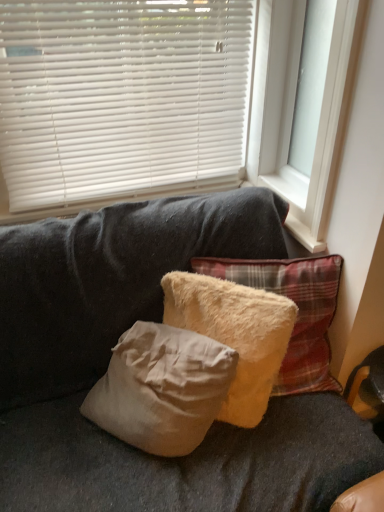
You are a GUI agent. You are given a task and a screenshot of the screen. Output one action in this format:
    pyautogui.click(x=<x>, y=<y>)
    Task: Click on the fuzzy beige pillow at center, which is the 1th pillow from right to left
    
    Given the screenshot: What is the action you would take?
    pyautogui.click(x=298, y=312)

The image size is (384, 512). What do you see at coordinates (121, 96) in the screenshot?
I see `white plastic blinds at upper center` at bounding box center [121, 96].

Locate an element on the screen. The width and height of the screenshot is (384, 512). white plastic blinds at upper center is located at coordinates (121, 96).

The image size is (384, 512). I want to click on fuzzy beige pillow at center, which is the 1th pillow from right to left, so click(x=298, y=312).

Does white plastic blinds at upper center have a smaller size compared to white plastic window frame at upper right?

Actually, white plastic blinds at upper center might be larger than white plastic window frame at upper right.

From a real-world perspective, which is physically below, white plastic blinds at upper center or white plastic window frame at upper right?

white plastic window frame at upper right, from a real-world perspective.

This screenshot has width=384, height=512. What are the coordinates of `window frame in front of the white plastic blinds at upper center` in the screenshot? It's located at (304, 105).

Would you consider white plastic blinds at upper center to be distant from white plastic window frame at upper right?

They are positioned close to each other.

Consider the image. Looking at the image, does white plastic window frame at upper right seem bigger or smaller compared to white plastic blinds at upper center?

Clearly, white plastic window frame at upper right is smaller in size than white plastic blinds at upper center.

Is point (311, 154) in front of point (125, 124)?

No, (311, 154) is behind (125, 124).

Is white plastic window frame at upper right far from white plastic blinds at upper center?

No, white plastic window frame at upper right is in close proximity to white plastic blinds at upper center.

Is white plastic window frame at upper right to the right of white plastic blinds at upper center from the viewer's perspective?

Yes, white plastic window frame at upper right is to the right of white plastic blinds at upper center.

Could you measure the distance between fuzzy beige pillow at center, the second pillow in the left-to-right sequence, and beige fluffy pillow at center, positioned as the second pillow in right-to-left order?

fuzzy beige pillow at center, the second pillow in the left-to-right sequence, is 5.28 inches from beige fluffy pillow at center, positioned as the second pillow in right-to-left order.

Is fuzzy beige pillow at center, the second pillow in the left-to-right sequence, surrounding beige fluffy pillow at center, which ranks as the first pillow in left-to-right order?

Yes, fuzzy beige pillow at center, the second pillow in the left-to-right sequence, contains beige fluffy pillow at center, which ranks as the first pillow in left-to-right order.

Which of these two, fuzzy beige pillow at center, which is the 1th pillow from right to left, or beige fluffy pillow at center, which ranks as the first pillow in left-to-right order, is wider?

With larger width is fuzzy beige pillow at center, which is the 1th pillow from right to left.

Is white plastic window frame at upper right beside beige fluffy pillow at center, positioned as the second pillow in right-to-left order?

Result: No, white plastic window frame at upper right is not making contact with beige fluffy pillow at center, positioned as the second pillow in right-to-left order.

From the image's perspective, between white plastic window frame at upper right and beige fluffy pillow at center, which ranks as the first pillow in left-to-right order, which one is located above?

white plastic window frame at upper right is shown above in the image.

Is white plastic window frame at upper right oriented away from beige fluffy pillow at center, positioned as the second pillow in right-to-left order?

That's not correct — white plastic window frame at upper right is not looking away from beige fluffy pillow at center, positioned as the second pillow in right-to-left order.

Which object is positioned more to the left, white plastic window frame at upper right or beige fluffy pillow at center, positioned as the second pillow in right-to-left order?

beige fluffy pillow at center, positioned as the second pillow in right-to-left order, is more to the left.

Is fuzzy beige pillow at center, the second pillow in the left-to-right sequence, located within white plastic blinds at upper center?

No, fuzzy beige pillow at center, the second pillow in the left-to-right sequence, is located outside of white plastic blinds at upper center.

From a real-world perspective, does white plastic blinds at upper center stand above fuzzy beige pillow at center, which is the 1th pillow from right to left?

Correct, in the physical world, white plastic blinds at upper center is higher than fuzzy beige pillow at center, which is the 1th pillow from right to left.

How distant is white plastic blinds at upper center from fuzzy beige pillow at center, which is the 1th pillow from right to left?

white plastic blinds at upper center is 26.44 inches from fuzzy beige pillow at center, which is the 1th pillow from right to left.

Is white plastic blinds at upper center oriented towards fuzzy beige pillow at center, the second pillow in the left-to-right sequence?

No, white plastic blinds at upper center does not turn towards fuzzy beige pillow at center, the second pillow in the left-to-right sequence.

From a real-world perspective, is white plastic blinds at upper center beneath beige fluffy pillow at center, which ranks as the first pillow in left-to-right order?

No.

Is beige fluffy pillow at center, positioned as the second pillow in right-to-left order, at the back of white plastic blinds at upper center?

That's not correct — white plastic blinds at upper center is not looking away from beige fluffy pillow at center, positioned as the second pillow in right-to-left order.

Based on the photo, choose the correct answer: Is white plastic blinds at upper center inside beige fluffy pillow at center, which ranks as the first pillow in left-to-right order, or outside it?

white plastic blinds at upper center cannot be found inside beige fluffy pillow at center, which ranks as the first pillow in left-to-right order.

From the image's perspective, between white plastic blinds at upper center and beige fluffy pillow at center, which ranks as the first pillow in left-to-right order, which one is located above?

white plastic blinds at upper center.

Based on the photo, is beige fluffy pillow at center, positioned as the second pillow in right-to-left order, touching white plastic blinds at upper center?

No, beige fluffy pillow at center, positioned as the second pillow in right-to-left order, is not in contact with white plastic blinds at upper center.

Who is bigger, beige fluffy pillow at center, positioned as the second pillow in right-to-left order, or white plastic blinds at upper center?

white plastic blinds at upper center.

Is beige fluffy pillow at center, which ranks as the first pillow in left-to-right order, not within white plastic blinds at upper center?

Absolutely, beige fluffy pillow at center, which ranks as the first pillow in left-to-right order, is external to white plastic blinds at upper center.

This screenshot has width=384, height=512. Identify the location of window blind above the beige fluffy pillow at center, positioned as the second pillow in right-to-left order (from a real-world perspective). (121, 96).

There is a white plastic window frame at upper right. Identify the location of window blind above it (from a real-world perspective). The height and width of the screenshot is (512, 384). (121, 96).

What are the coordinates of `window frame below the white plastic blinds at upper center (from a real-world perspective)` in the screenshot? It's located at (304, 105).

Which object lies nearer to the anchor point white plastic window frame at upper right, fuzzy beige pillow at center, which is the 1th pillow from right to left, or white plastic blinds at upper center?

white plastic blinds at upper center.

Which object lies nearer to the anchor point beige fluffy pillow at center, positioned as the second pillow in right-to-left order, white plastic window frame at upper right or fuzzy beige pillow at center, the second pillow in the left-to-right sequence?

Among the two, fuzzy beige pillow at center, the second pillow in the left-to-right sequence, is located nearer to beige fluffy pillow at center, positioned as the second pillow in right-to-left order.

Looking at the image, which one is located closer to beige fluffy pillow at center, which ranks as the first pillow in left-to-right order, white plastic window frame at upper right or white plastic blinds at upper center?

Based on the image, white plastic window frame at upper right appears to be nearer to beige fluffy pillow at center, which ranks as the first pillow in left-to-right order.

Considering their positions, is beige fluffy pillow at center, positioned as the second pillow in right-to-left order, positioned further to fuzzy beige pillow at center, the second pillow in the left-to-right sequence, than white plastic window frame at upper right?

Among the two, white plastic window frame at upper right is located further to fuzzy beige pillow at center, the second pillow in the left-to-right sequence.

Which object lies further to the anchor point fuzzy beige pillow at center, the second pillow in the left-to-right sequence, beige fluffy pillow at center, which ranks as the first pillow in left-to-right order, or white plastic blinds at upper center?

white plastic blinds at upper center lies further to fuzzy beige pillow at center, the second pillow in the left-to-right sequence, than the other object.

Considering their positions, is white plastic blinds at upper center positioned further to beige fluffy pillow at center, which ranks as the first pillow in left-to-right order, than white plastic window frame at upper right?

white plastic blinds at upper center is further to beige fluffy pillow at center, which ranks as the first pillow in left-to-right order.

From the image, which object appears to be nearer to fuzzy beige pillow at center, the second pillow in the left-to-right sequence, white plastic blinds at upper center or white plastic window frame at upper right?

Based on the image, white plastic window frame at upper right appears to be nearer to fuzzy beige pillow at center, the second pillow in the left-to-right sequence.

Estimate the real-world distances between objects in this image. Which object is further from white plastic window frame at upper right, beige fluffy pillow at center, which ranks as the first pillow in left-to-right order, or white plastic blinds at upper center?

beige fluffy pillow at center, which ranks as the first pillow in left-to-right order, is positioned further to the anchor white plastic window frame at upper right.

This screenshot has width=384, height=512. Find the location of `window frame between white plastic blinds at upper center and fuzzy beige pillow at center, the second pillow in the left-to-right sequence, in the vertical direction`. window frame between white plastic blinds at upper center and fuzzy beige pillow at center, the second pillow in the left-to-right sequence, in the vertical direction is located at coordinates 304,105.

Find the location of a particular element. This screenshot has height=512, width=384. pillow between white plastic window frame at upper right and beige fluffy pillow at center, positioned as the second pillow in right-to-left order, vertically is located at coordinates (298, 312).

Locate an element on the screen. pillow between white plastic blinds at upper center and beige fluffy pillow at center, positioned as the second pillow in right-to-left order, in the vertical direction is located at coordinates (298, 312).

The image size is (384, 512). Find the location of `window frame between white plastic blinds at upper center and beige fluffy pillow at center, positioned as the second pillow in right-to-left order, in the vertical direction`. window frame between white plastic blinds at upper center and beige fluffy pillow at center, positioned as the second pillow in right-to-left order, in the vertical direction is located at coordinates (304, 105).